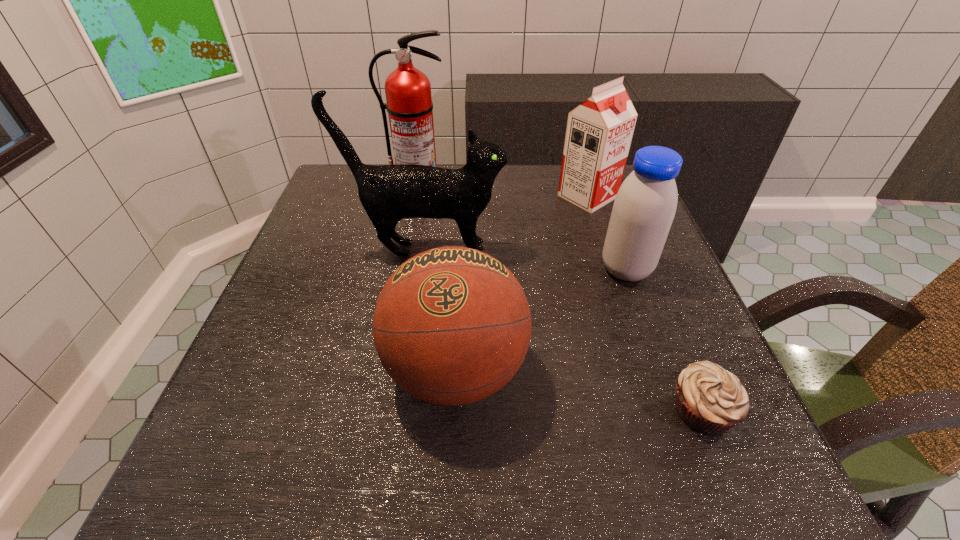
You are a GUI agent. You are given a task and a screenshot of the screen. Output one action in this format:
    pyautogui.click(x=<x>, y=<y>)
    Task: Click on the fire extinguisher
    
    Given the screenshot: What is the action you would take?
    pyautogui.click(x=409, y=104)

The width and height of the screenshot is (960, 540). I want to click on cat, so click(x=390, y=193).

Locate an element on the screen. This screenshot has height=540, width=960. the farther soya milk is located at coordinates (599, 132).

Where is `the nearer soya milk`? The width and height of the screenshot is (960, 540). the nearer soya milk is located at coordinates (644, 208).

Find the location of a particular element. The height and width of the screenshot is (540, 960). basketball is located at coordinates (452, 325).

Identify the location of muffin. This screenshot has width=960, height=540. (710, 400).

Locate an element on the screen. free space located at the nozzle of the fire extinguisher is located at coordinates click(x=404, y=251).

Where is `free spot located 0.300m on the face of the cat`? The image size is (960, 540). free spot located 0.300m on the face of the cat is located at coordinates (636, 249).

Image resolution: width=960 pixels, height=540 pixels. I want to click on free region located on the back of the farther soya milk, so click(577, 165).

Locate an element on the screen. free space located 0.230m on the front of the nearer soya milk is located at coordinates click(667, 384).